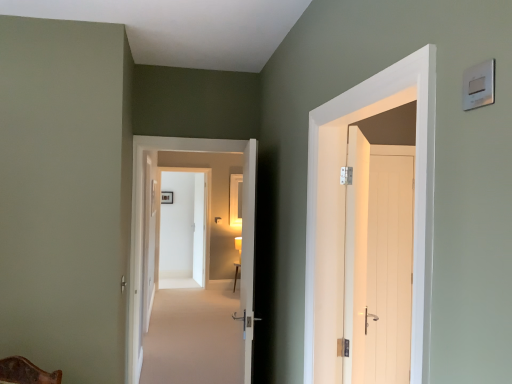
Locate an element on the screen. The image size is (512, 384). vacant space that is to the left of wooden table at center is located at coordinates (223, 290).